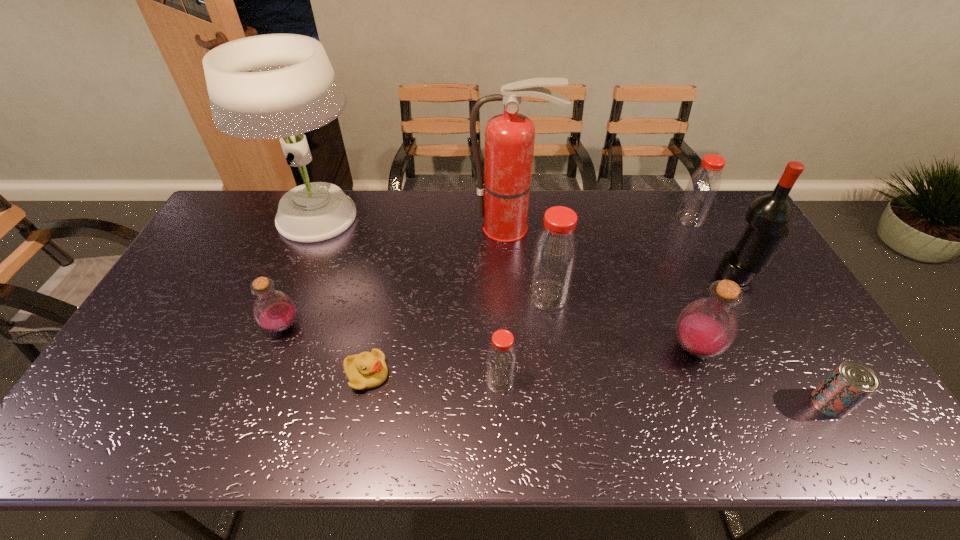
Locate an element on the screen. vacant area situated on the back of the red wine bottle is located at coordinates (699, 206).

Identify the location of blank space located on the front of the third bottle from right to left. (558, 359).

Locate an element on the screen. vacant space located 0.100m on the back of the farthest bottle is located at coordinates (677, 194).

You are a GUI agent. You are given a task and a screenshot of the screen. Output one action in this format:
    pyautogui.click(x=<x>, y=<y>)
    Task: Click on the vacant region located on the right of the right purple bottle
    The image size is (960, 540).
    Given the screenshot: What is the action you would take?
    pyautogui.click(x=739, y=348)

Where is `vacant space located on the right of the smallest red bottle`? vacant space located on the right of the smallest red bottle is located at coordinates (607, 381).

The image size is (960, 540). Find the location of `vacant space located 0.240m on the left of the leftmost bottle`. vacant space located 0.240m on the left of the leftmost bottle is located at coordinates (178, 326).

The height and width of the screenshot is (540, 960). Find the location of `vacant point located on the left of the second shortest object`. vacant point located on the left of the second shortest object is located at coordinates (780, 403).

The image size is (960, 540). I want to click on vacant space positioned 0.050m on the front-facing side of the shortest object, so click(408, 374).

The image size is (960, 540). I want to click on lamp present at the far edge, so click(270, 86).

Find the location of a particular element. The width and height of the screenshot is (960, 540). fire extinguisher that is at the far edge is located at coordinates (503, 196).